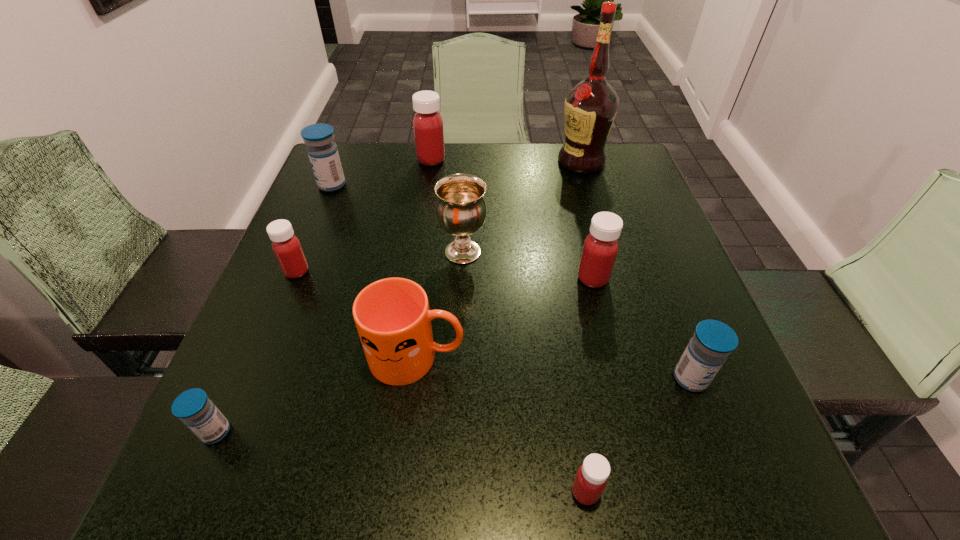
Where is `the second biggest blue medicine`? the second biggest blue medicine is located at coordinates (712, 342).

Locate an element on the screen. The height and width of the screenshot is (540, 960). the fifth farthest medicine is located at coordinates (712, 342).

At what (x,y) coordinates should I click in order to perform the action: click on the leftmost red medicine. Please return your answer as a coordinate pair (x, y). Looking at the image, I should click on (286, 246).

Identify the location of the second nearest object. This screenshot has width=960, height=540. (195, 409).

Identify the location of the nearest blue medicine. This screenshot has width=960, height=540. (195, 409).

Where is `the third red medicine from left to right`? The width and height of the screenshot is (960, 540). the third red medicine from left to right is located at coordinates tap(591, 478).

This screenshot has width=960, height=540. I want to click on the nearest red medicine, so click(x=591, y=478).

Where is `free space located 0.090m on the label of the brown alcohol`? free space located 0.090m on the label of the brown alcohol is located at coordinates [524, 162].

Locate an element on the screen. This screenshot has height=540, width=960. free space located on the label of the brown alcohol is located at coordinates (473, 162).

Where is `vacant space located 0.280m on the label of the brown alcohol`? This screenshot has width=960, height=540. vacant space located 0.280m on the label of the brown alcohol is located at coordinates (455, 162).